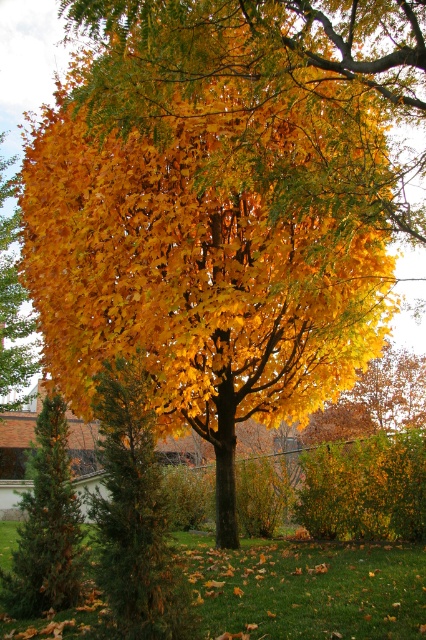
Which of these two, green matte evergreen at left or green needle-like at left, stands taller?

Standing taller between the two is green needle-like at left.

Between green matte evergreen at left and green needle-like at left, which one appears on the right side from the viewer's perspective?

green matte evergreen at left is more to the right.

Does point (118, 404) come farther from viewer compared to point (43, 592)?

That is False.

In order to click on green matte evergreen at left in this screenshot , I will do pyautogui.click(x=134, y=515).